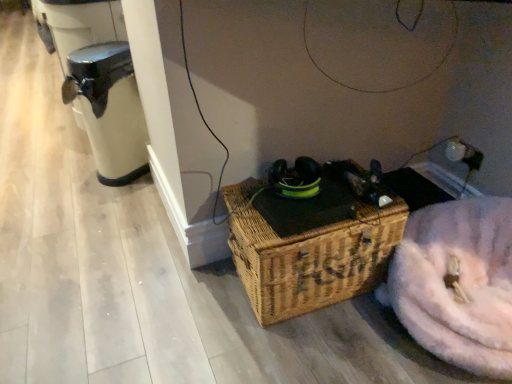
Question: Considering their positions, is white fluffy washer at lower right located in front of or behind woven brown picnic basket at center?

Choices:
 (A) front
 (B) behind

Answer: (A)

Question: Looking at their shapes, would you say white fluffy washer at lower right is wider or thinner than woven brown picnic basket at center?

Choices:
 (A) wide
 (B) thin

Answer: (A)

Question: Which object is the farthest from the white fluffy washer at lower right?

Choices:
 (A) black plastic water heater at left
 (B) woven brown picnic basket at center

Answer: (A)

Question: Which is farther from the black plastic water heater at left?

Choices:
 (A) woven brown picnic basket at center
 (B) white fluffy washer at lower right

Answer: (B)